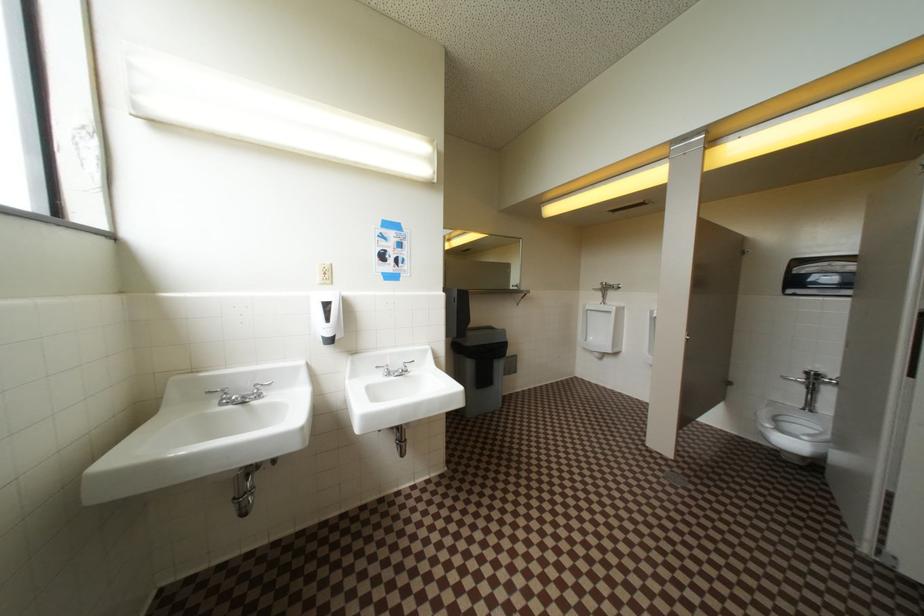
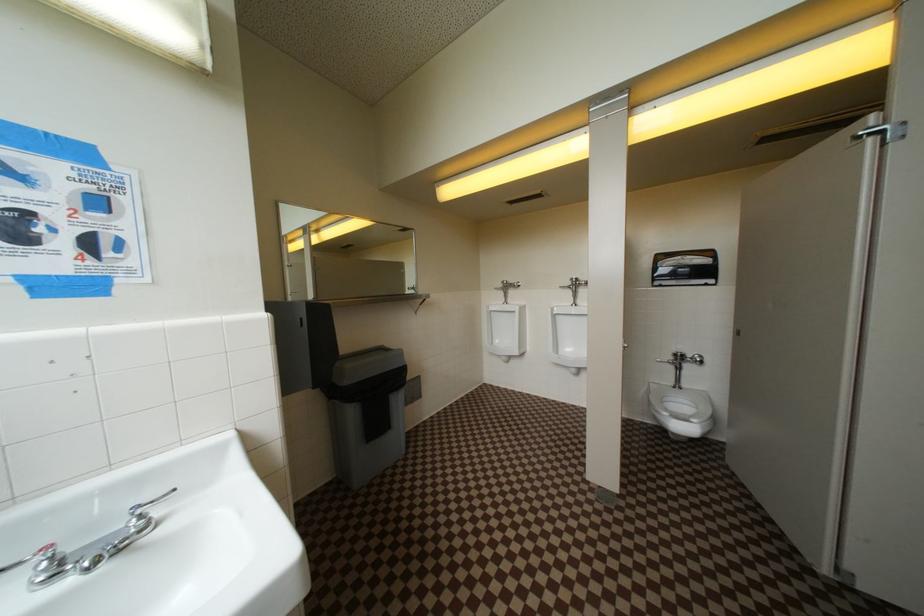
Question: Which direction would the cameraman need to move to produce the second image? Reply with the corresponding letter.

Choices:
 (A) Left
 (B) Right
 (C) Forward
 (D) Backward

Answer: (C)